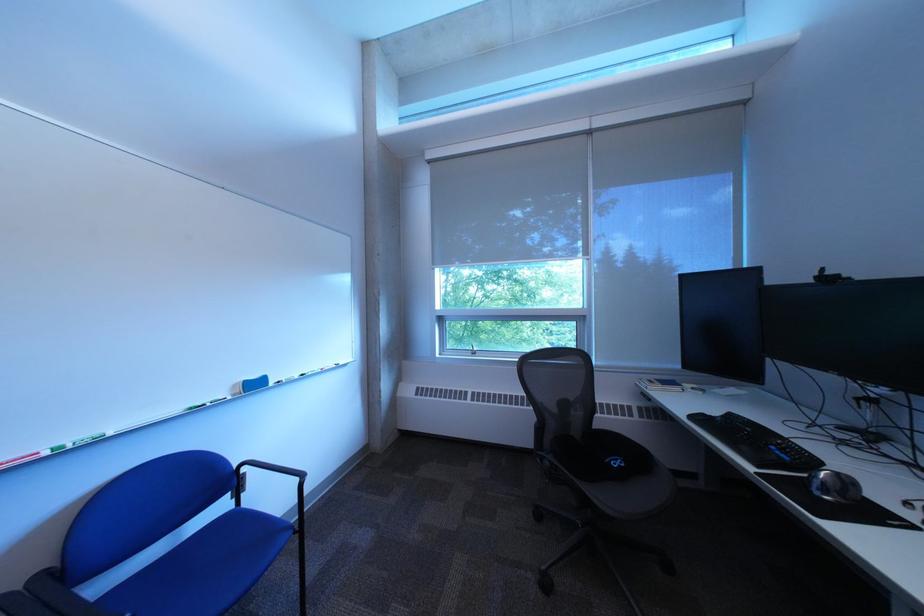
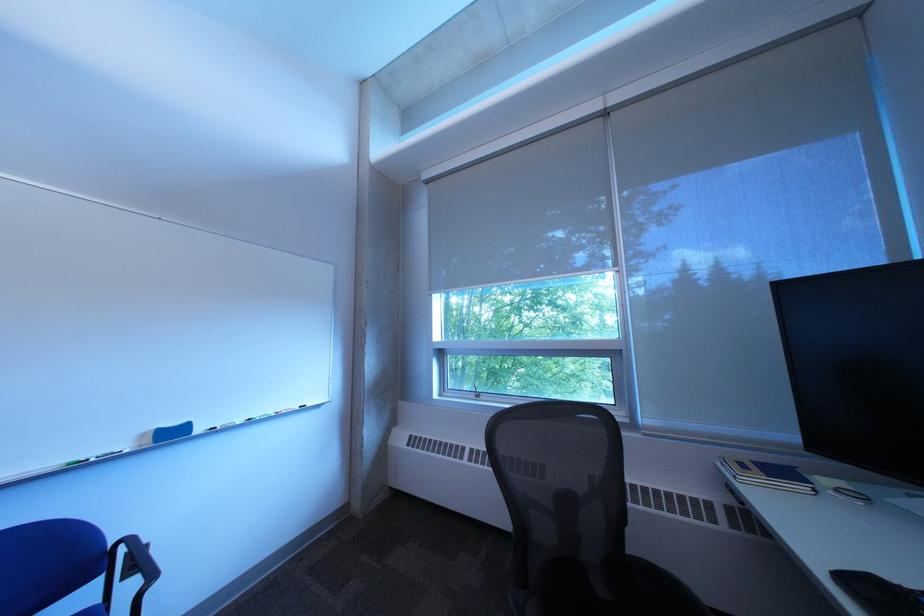
Find the pixel in the second image that matches [286,384] in the first image.

(213, 432)